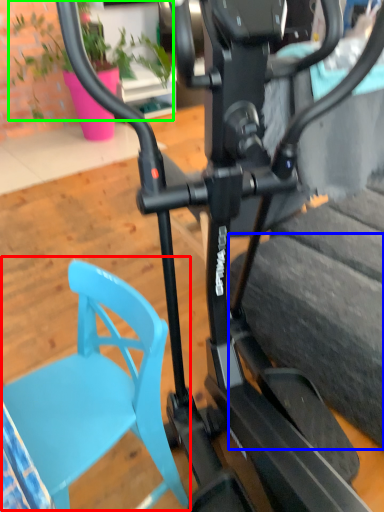
Question: Considering the real-world distances, which object is farthest from swivel chair (highlighted by a red box)? tire (highlighted by a blue box) or plant (highlighted by a green box)?

Choices:
 (A) tire
 (B) plant

Answer: (B)